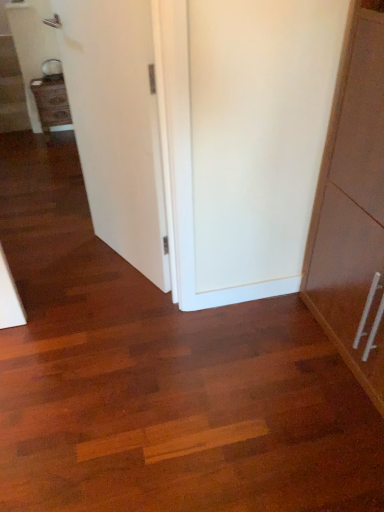
Question: Can you confirm if wooden staircase at left is taller than matte wood cabinet at left?

Choices:
 (A) no
 (B) yes

Answer: (A)

Question: Can you confirm if wooden staircase at left is positioned to the left of matte wood cabinet at left?

Choices:
 (A) no
 (B) yes

Answer: (B)

Question: Is wooden staircase at left surrounding matte wood cabinet at left?

Choices:
 (A) no
 (B) yes

Answer: (A)

Question: From the image's perspective, would you say wooden staircase at left is positioned over matte wood cabinet at left?

Choices:
 (A) no
 (B) yes

Answer: (B)

Question: Is wooden staircase at left shorter than matte wood cabinet at left?

Choices:
 (A) yes
 (B) no

Answer: (A)

Question: From the image's perspective, is matte wood cabinet at left above or below wooden staircase at left?

Choices:
 (A) above
 (B) below

Answer: (B)

Question: Would you say matte wood cabinet at left is inside or outside wooden staircase at left?

Choices:
 (A) inside
 (B) outside

Answer: (B)

Question: Is point (52, 121) positioned closer to the camera than point (3, 37)?

Choices:
 (A) closer
 (B) farther

Answer: (A)

Question: Considering the positions of matte wood cabinet at left and wooden staircase at left in the image, is matte wood cabinet at left wider or thinner than wooden staircase at left?

Choices:
 (A) wide
 (B) thin

Answer: (B)

Question: From the image's perspective, relative to matte wood cabinet at left, is white smooth door at center above or below?

Choices:
 (A) above
 (B) below

Answer: (B)

Question: In terms of height, does white smooth door at center look taller or shorter compared to matte wood cabinet at left?

Choices:
 (A) short
 (B) tall

Answer: (B)

Question: From a real-world perspective, is white smooth door at center physically located above or below matte wood cabinet at left?

Choices:
 (A) below
 (B) above

Answer: (B)

Question: In terms of width, does white smooth door at center look wider or thinner when compared to matte wood cabinet at left?

Choices:
 (A) thin
 (B) wide

Answer: (A)

Question: Based on their sizes in the image, would you say wooden staircase at left is bigger or smaller than matte wood cabinet at left?

Choices:
 (A) big
 (B) small

Answer: (A)

Question: Relative to matte wood cabinet at left, is wooden staircase at left in front or behind?

Choices:
 (A) behind
 (B) front

Answer: (A)